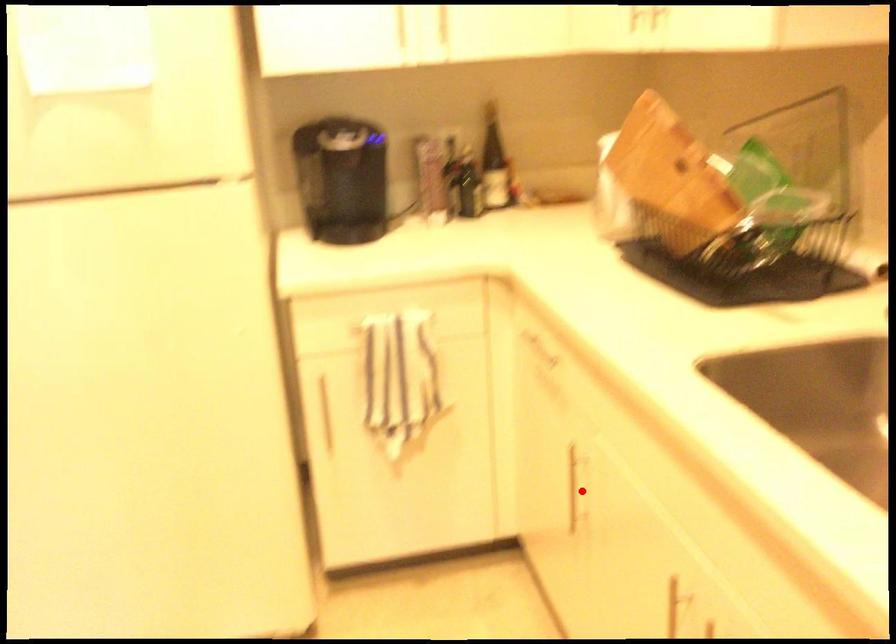
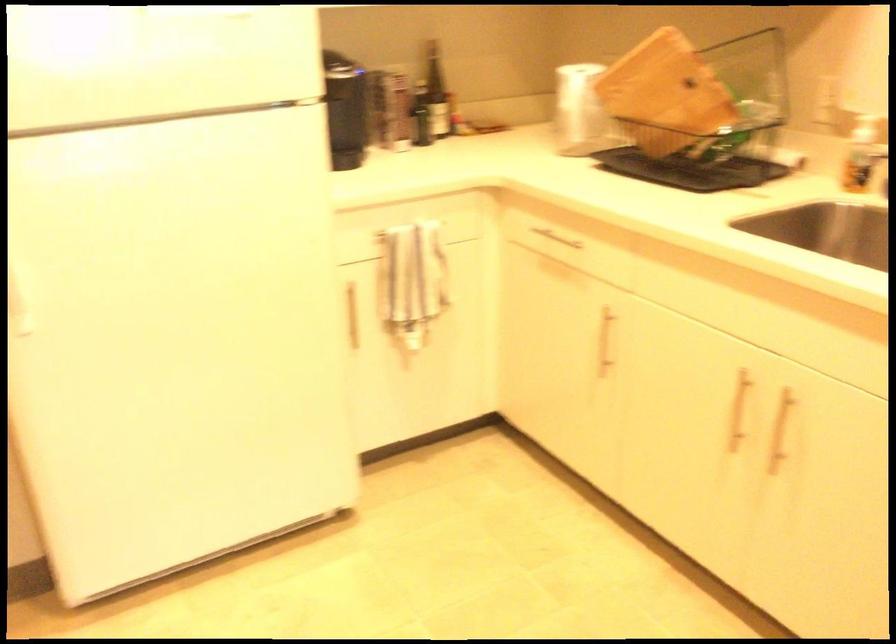
Question: A red point is marked in image1. In image2, is the corresponding 3D point closer to the camera or farther? Reply with the corresponding letter.

Choices:
 (A) The corresponding 3D point is closer.
 (B) The corresponding 3D point is farther.

Answer: (B)